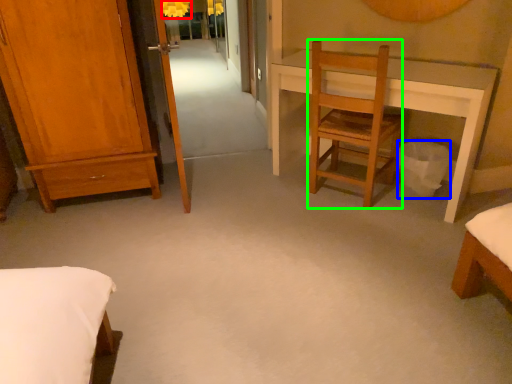
Question: Which object is the farthest from lamp (highlighted by a red box)? Choose among these: trash bin/can (highlighted by a blue box) or chair (highlighted by a green box).

Choices:
 (A) trash bin/can
 (B) chair

Answer: (A)